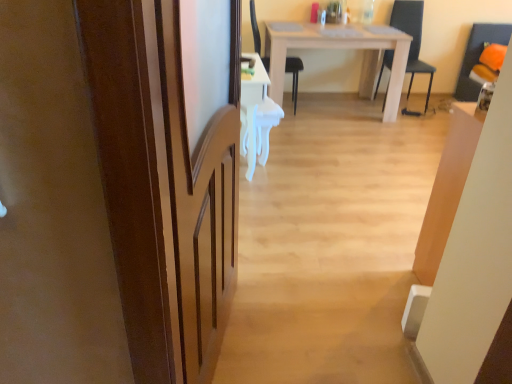
Question: From a real-world perspective, relative to white glossy desk at center, is brown wooden screen door at left vertically above or below?

Choices:
 (A) above
 (B) below

Answer: (A)

Question: Is point pos(170,150) closer or farther from the camera than point pos(283,112)?

Choices:
 (A) closer
 (B) farther

Answer: (A)

Question: Considering the real-world distances, which object is farthest from the black plastic chair at center, the first chair in the left-to-right sequence?

Choices:
 (A) brown wooden screen door at left
 (B) black matte chair at center, which appears as the 1th chair when viewed from the right
 (C) white glossy desk at center
 (D) white matte table at center

Answer: (A)

Question: Which object is positioned closest to the black plastic chair at center, the first chair in the left-to-right sequence?

Choices:
 (A) white matte table at center
 (B) brown wooden screen door at left
 (C) black matte chair at center, which appears as the 1th chair when viewed from the right
 (D) white glossy desk at center

Answer: (A)